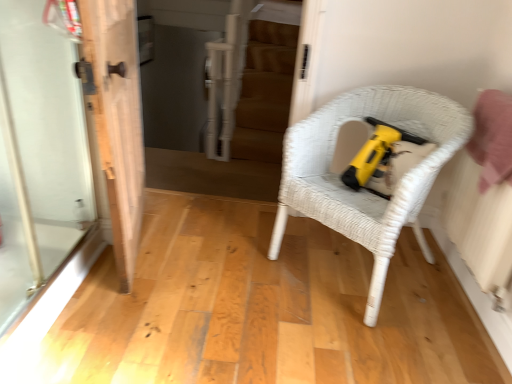
Identify the location of vacant area that is in front of white wicker chair at center. This screenshot has height=384, width=512. (356, 345).